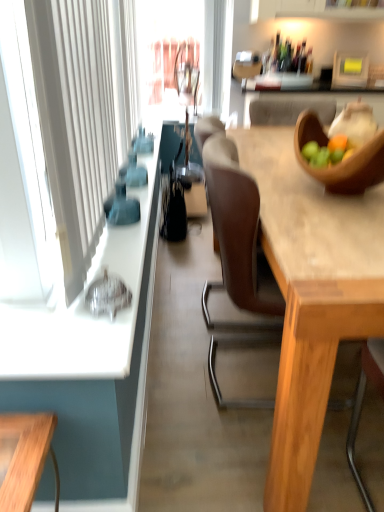
Question: Considering the positions of white fabric curtain at left and wooden bowl at upper right in the image, is white fabric curtain at left wider or thinner than wooden bowl at upper right?

Choices:
 (A) thin
 (B) wide

Answer: (A)

Question: Is point (92, 89) closer or farther from the camera than point (306, 119)?

Choices:
 (A) farther
 (B) closer

Answer: (B)

Question: Which of these objects is positioned farthest from the white fabric curtain at left?

Choices:
 (A) wooden table at center
 (B) black leather handbag at center
 (C) wooden bowl at upper right

Answer: (B)

Question: Which of these objects is positioned farthest from the wooden table at center?

Choices:
 (A) white fabric curtain at left
 (B) black leather handbag at center
 (C) wooden bowl at upper right

Answer: (B)